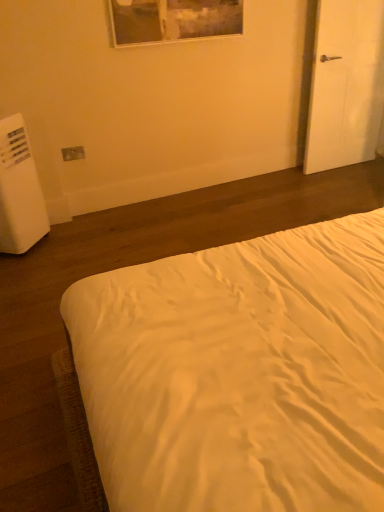
Question: Does white matte door at right appear on the left side of white plastic water heater at left?

Choices:
 (A) yes
 (B) no

Answer: (B)

Question: From a real-world perspective, is white matte door at right positioned under white plastic water heater at left based on gravity?

Choices:
 (A) yes
 (B) no

Answer: (B)

Question: Can you confirm if white matte door at right is shorter than white plastic water heater at left?

Choices:
 (A) yes
 (B) no

Answer: (B)

Question: Is white matte door at right to the right of white plastic water heater at left from the viewer's perspective?

Choices:
 (A) no
 (B) yes

Answer: (B)

Question: Is white plastic water heater at left a part of white matte door at right?

Choices:
 (A) yes
 (B) no

Answer: (B)

Question: Does white matte door at right have a greater width compared to white plastic water heater at left?

Choices:
 (A) no
 (B) yes

Answer: (A)

Question: From a real-world perspective, is matte plastic outlet at lower left physically below white plastic water heater at left?

Choices:
 (A) no
 (B) yes

Answer: (A)

Question: Is matte plastic outlet at lower left taller than white plastic water heater at left?

Choices:
 (A) no
 (B) yes

Answer: (A)

Question: Is matte plastic outlet at lower left thinner than white plastic water heater at left?

Choices:
 (A) no
 (B) yes

Answer: (B)

Question: From the image's perspective, does matte plastic outlet at lower left appear lower than white plastic water heater at left?

Choices:
 (A) no
 (B) yes

Answer: (A)

Question: Could you tell me if matte plastic outlet at lower left is facing white plastic water heater at left?

Choices:
 (A) no
 (B) yes

Answer: (A)

Question: Could white plastic water heater at left be considered to be inside matte plastic outlet at lower left?

Choices:
 (A) yes
 (B) no

Answer: (B)

Question: Is white matte door at right thinner than white satin bed at center?

Choices:
 (A) no
 (B) yes

Answer: (B)